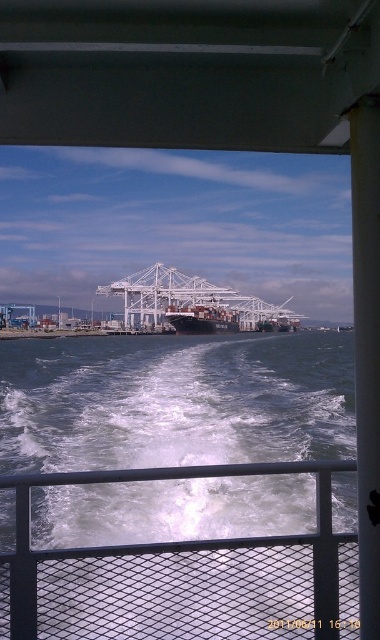
Question: Is black metal/rail at center to the left of black matte container ship at center from the viewer's perspective?

Choices:
 (A) yes
 (B) no

Answer: (A)

Question: Which of the following is the closest to the observer?

Choices:
 (A) (283, 577)
 (B) (215, 305)

Answer: (A)

Question: Can you confirm if black metal/rail at center is smaller than black matte container ship at center?

Choices:
 (A) yes
 (B) no

Answer: (A)

Question: Is black metal/rail at center wider than black matte container ship at center?

Choices:
 (A) yes
 (B) no

Answer: (B)

Question: Which point appears closest to the camera in this image?

Choices:
 (A) (185, 307)
 (B) (9, 554)

Answer: (B)